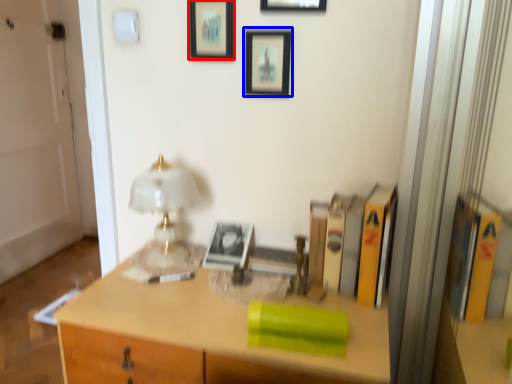
Question: Which point is further to the camera, picture frame (highlighted by a red box) or picture frame (highlighted by a blue box)?

Choices:
 (A) picture frame
 (B) picture frame

Answer: (A)